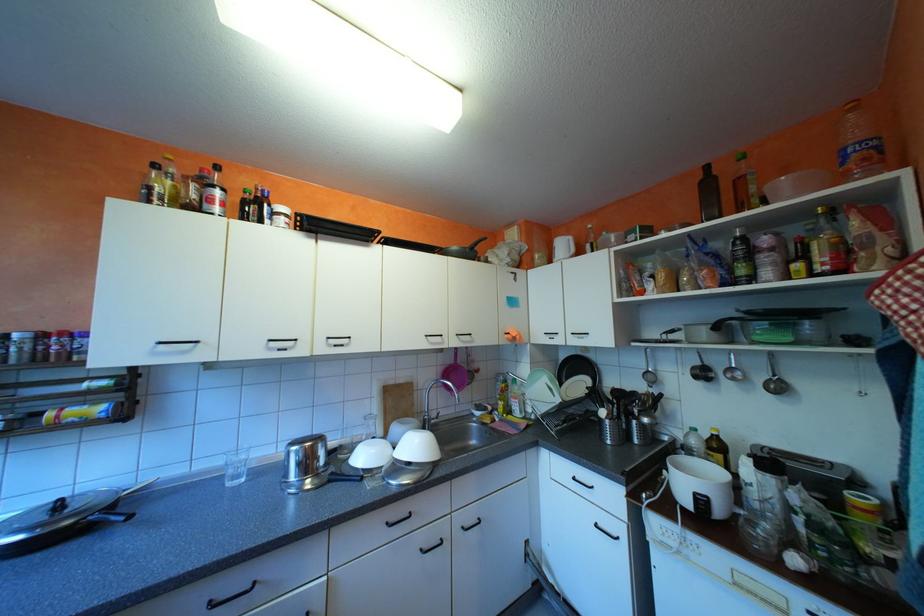
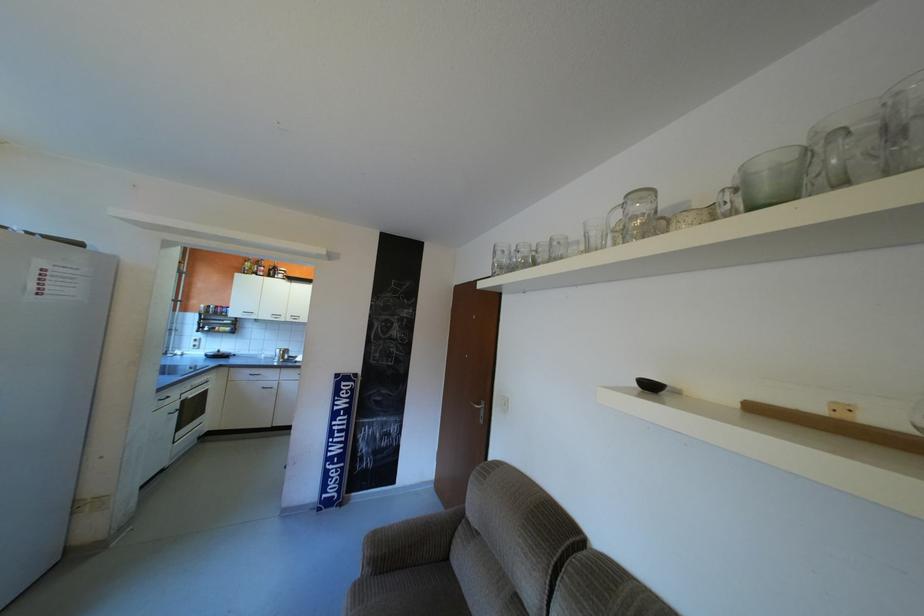
Find the pixel in the second image that matches point (334, 349) in the first image.

(300, 318)